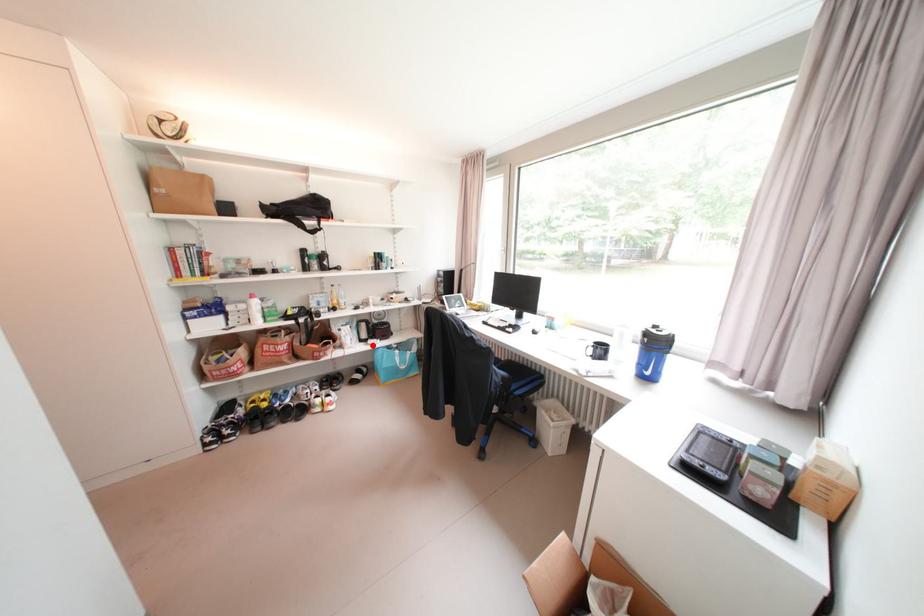
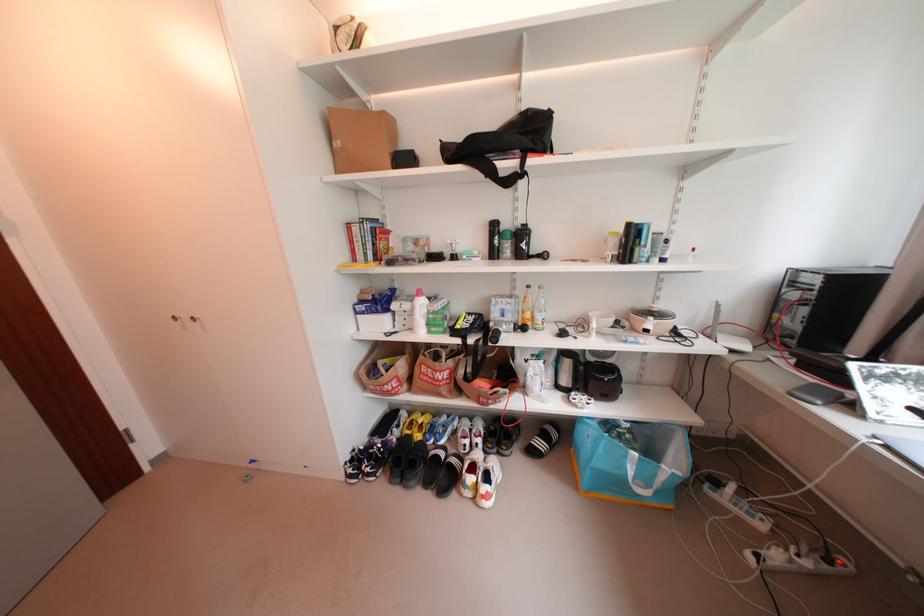
The point at the highlighted location is marked in the first image. Where is the corresponding point in the second image?

(572, 399)